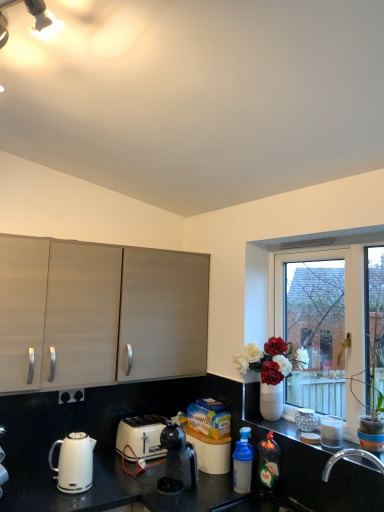
Identify the location of vacant area situated to the left side of metallic silver canisters at right, marked as the 2th appliance in a front-to-back arrangement. (272, 429).